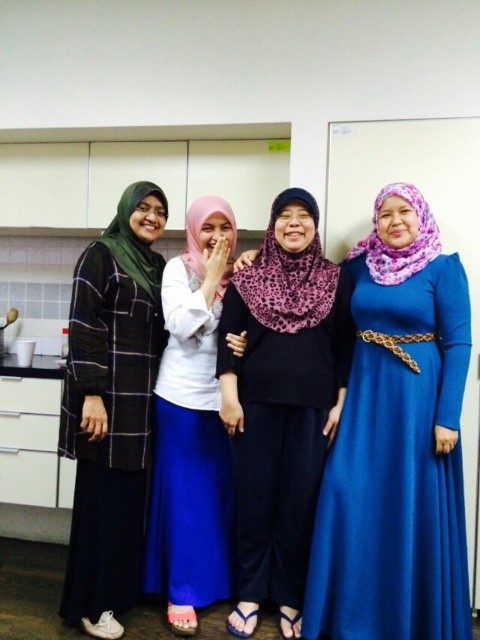
What do you see at coordinates (282, 403) in the screenshot?
I see `purple leopard print hijab at center` at bounding box center [282, 403].

Consider the image. Who is more forward, (240,433) or (83,476)?

Positioned in front is point (240,433).

Locate an element on the screen. purple leopard print hijab at center is located at coordinates (282, 403).

Can you confirm if matte black hijab at left is bigger than white matte hijab at center?

Yes, matte black hijab at left is bigger than white matte hijab at center.

Does matte black hijab at left appear over white matte hijab at center?

Yes.

The image size is (480, 640). I want to click on matte black hijab at left, so click(x=111, y=410).

This screenshot has height=640, width=480. Find the location of `matte black hijab at left`. matte black hijab at left is located at coordinates (111, 410).

Is blue satin dress at right in front of purple leopard print hijab at center?

Yes, blue satin dress at right is in front of purple leopard print hijab at center.

Who is positioned more to the right, blue satin dress at right or purple leopard print hijab at center?

Positioned to the right is blue satin dress at right.

This screenshot has width=480, height=640. Describe the element at coordinates (396, 467) in the screenshot. I see `blue satin dress at right` at that location.

Find the location of a particular element. This screenshot has width=480, height=640. blue satin dress at right is located at coordinates (396, 467).